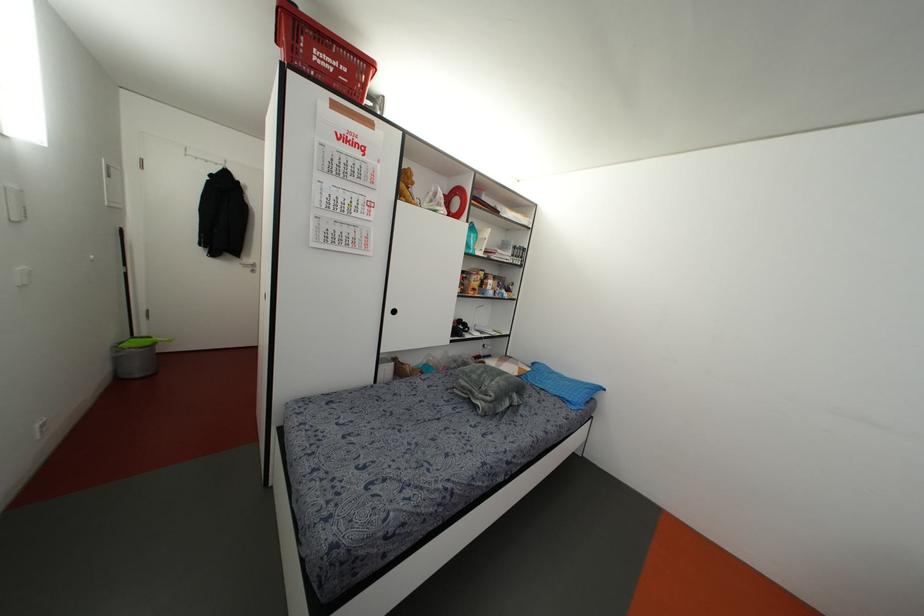
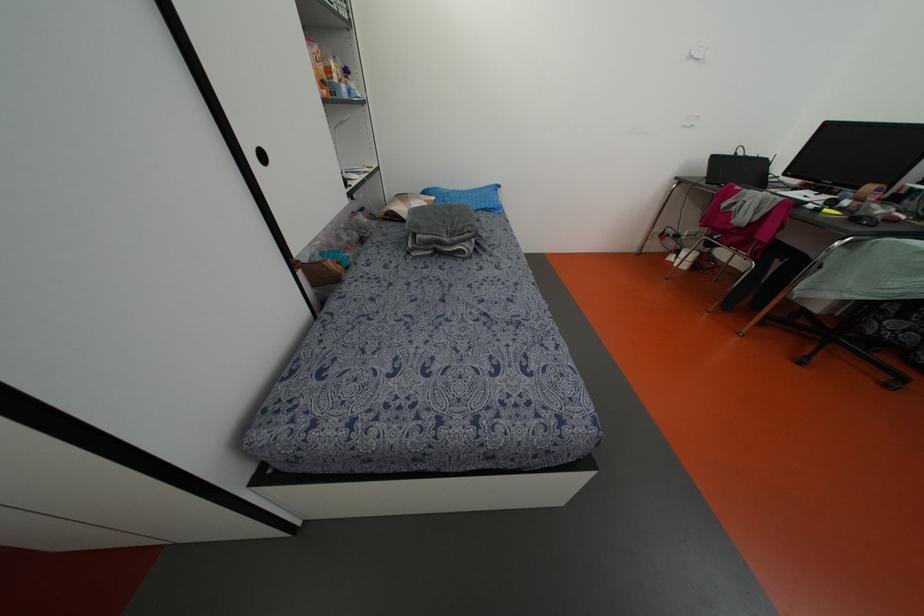
Where in the second image is the point corresponding to [394,310] from the first image?

(262, 156)